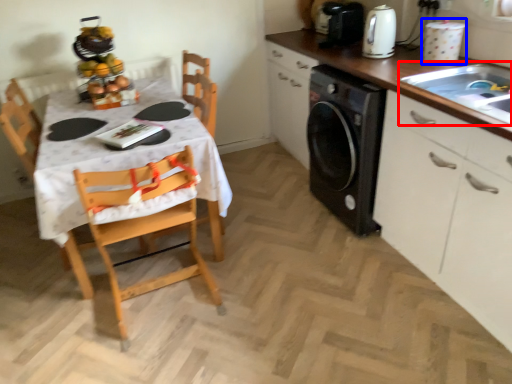
Question: Which of the following is the farthest to the observer, sink (highlighted by a red box) or appliance (highlighted by a blue box)?

Choices:
 (A) sink
 (B) appliance

Answer: (B)